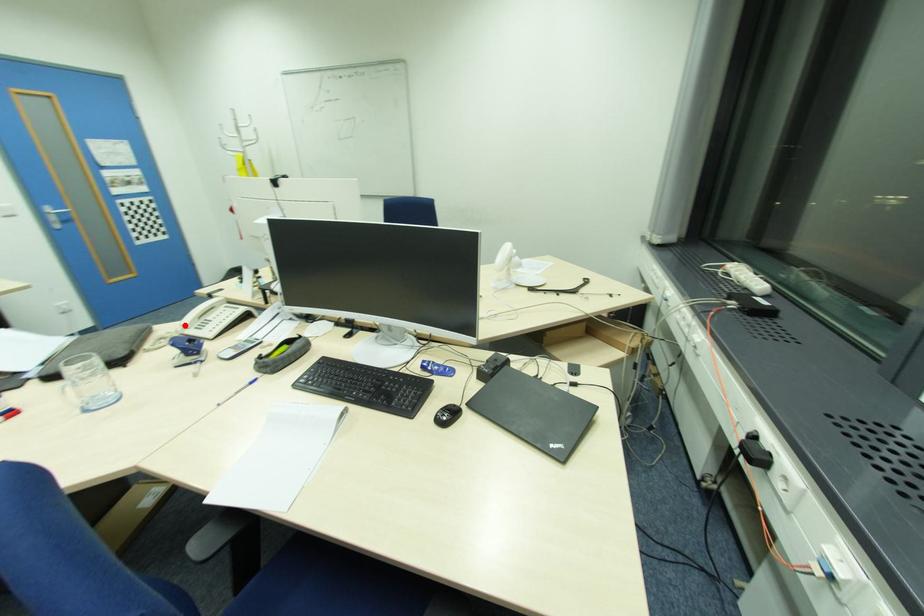
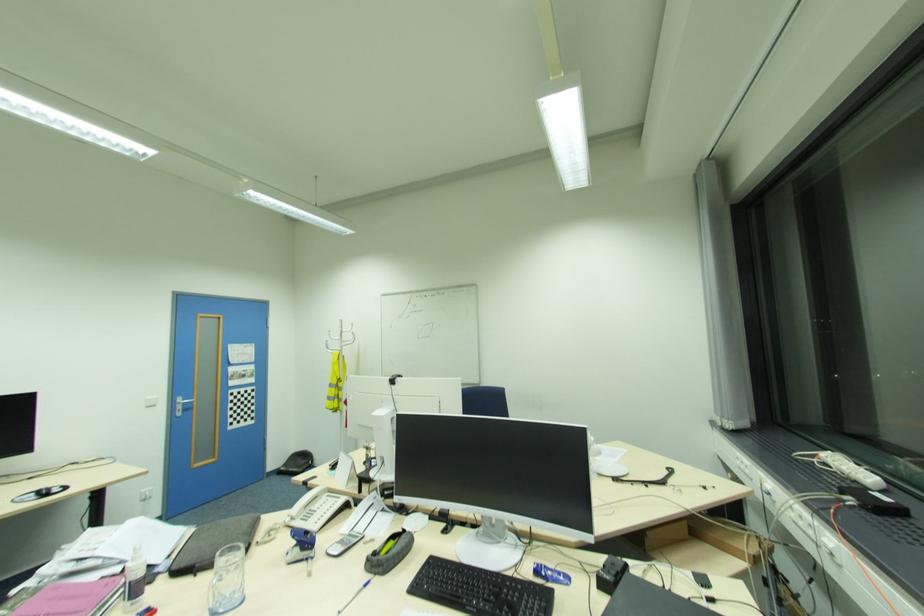
Find the pixel in the second image that matches the highlighted location in the first image.

(292, 516)